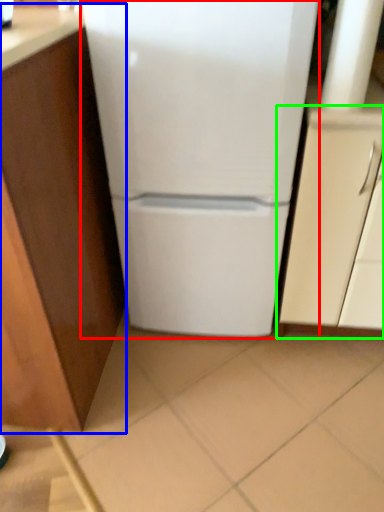
Question: Which object is the farthest from refrigerator (highlighted by a red box)? Choose among these: cabinetry (highlighted by a blue box) or cabinetry (highlighted by a green box).

Choices:
 (A) cabinetry
 (B) cabinetry

Answer: (A)